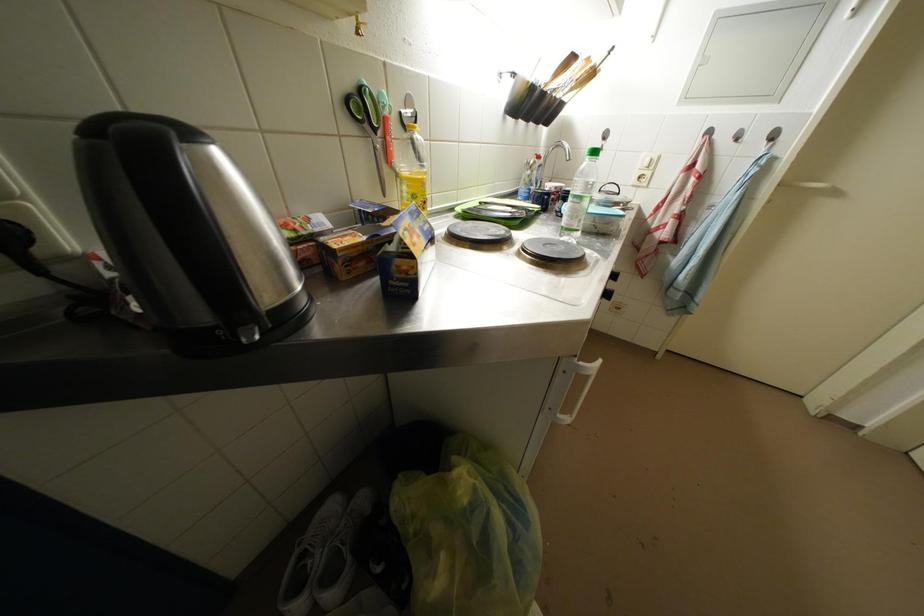
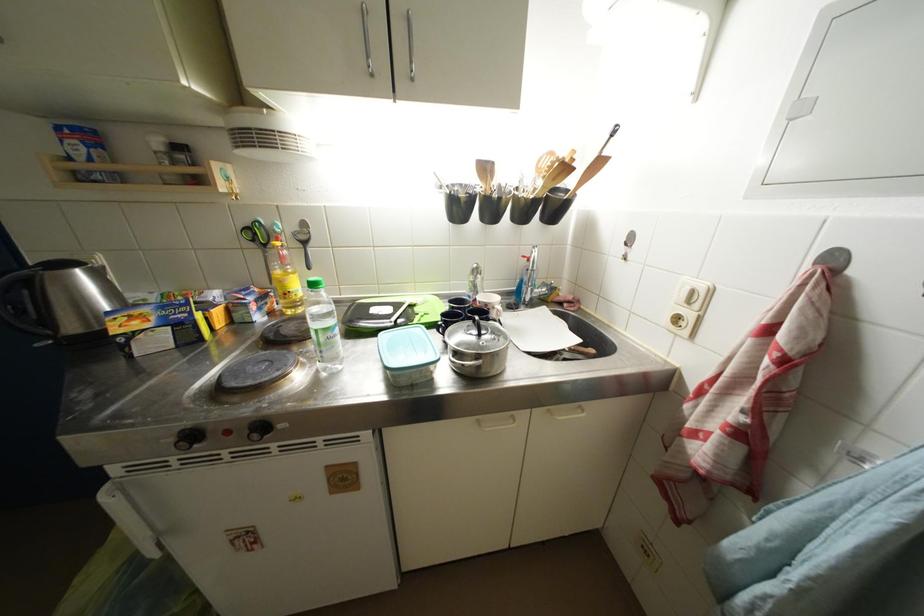
Where in the second image is the point corresponding to (600,70) from the first image?

(565, 164)